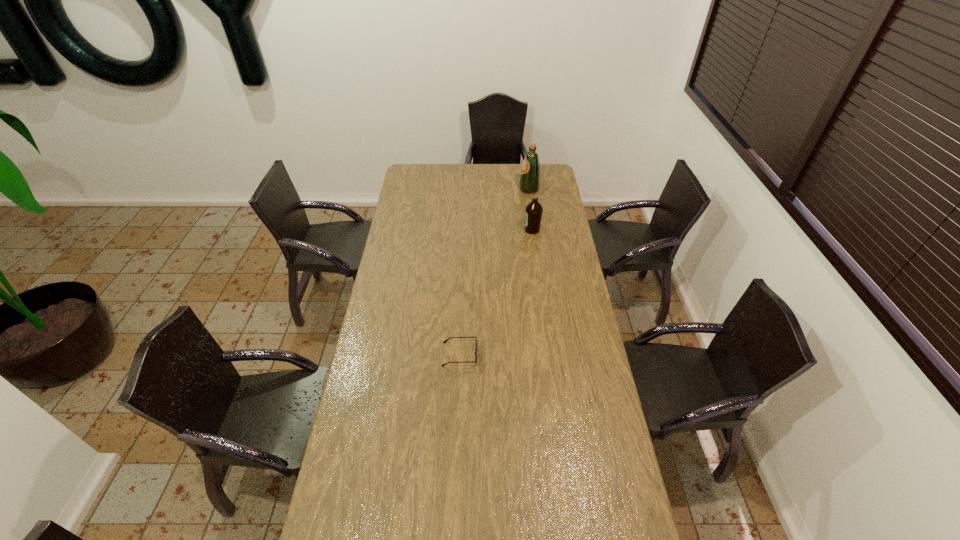
Locate an element on the screen. The image size is (960, 540). free spot between the tallest object and the nearest object is located at coordinates (494, 272).

Locate an element on the screen. Image resolution: width=960 pixels, height=540 pixels. object that stands as the closest to the leftmost object is located at coordinates (533, 212).

The image size is (960, 540). Identify the location of object that is the nearest to the taller olive oil. pyautogui.click(x=533, y=212).